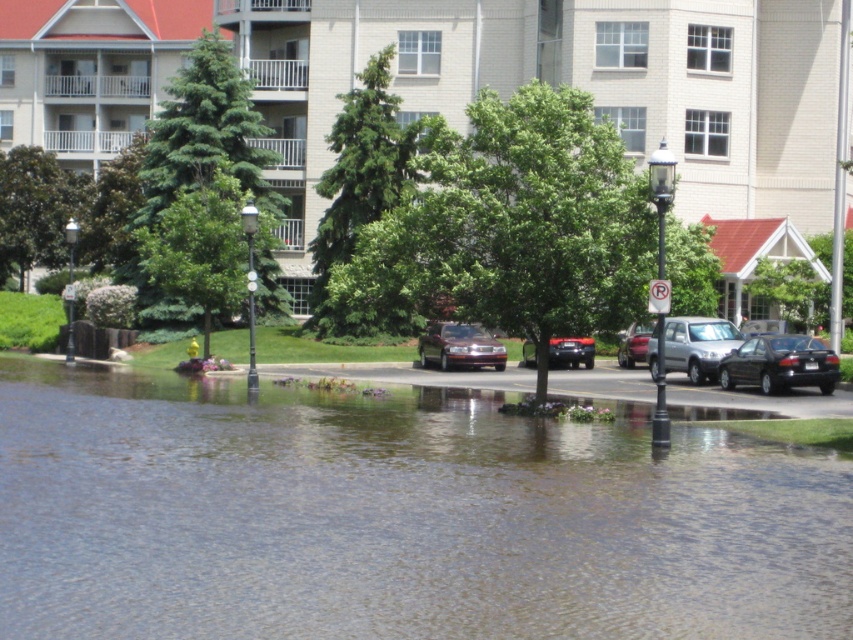
From the picture: You are a delivery person needing to unload a package between the satin silver suv at center and the shiny black sedan at center. The package requires 10 feet of space to safely place. Is there enough space between them?

The satin silver suv at center and shiny black sedan at center are 11.33 feet apart from each other, which is more than the required 10 feet, so there is enough space to safely place the package between them.

Based on the photo, you are a delivery driver who needs to unload a package between the shiny maroon sedan at center and the shiny silver sedan at center. The package requires a space of 5 meters. Is there enough space between them to place the package?

The shiny maroon sedan at center and shiny silver sedan at center are 4.74 meters apart. Since the required space is 5 meters, there isn not enough space between them to place the package.

In the scene shown: You are a delivery person trying to determine which vehicle to load packages into. The packages require a vehicle with more vertical space. Based on the scene, which vehicle between the satin silver suv at center and the shiny black sedan at center should you choose?

The satin silver suv at center has a greater height compared to the shiny black sedan at center, so you should choose the satin silver suv at center for the packages requiring more vertical space.